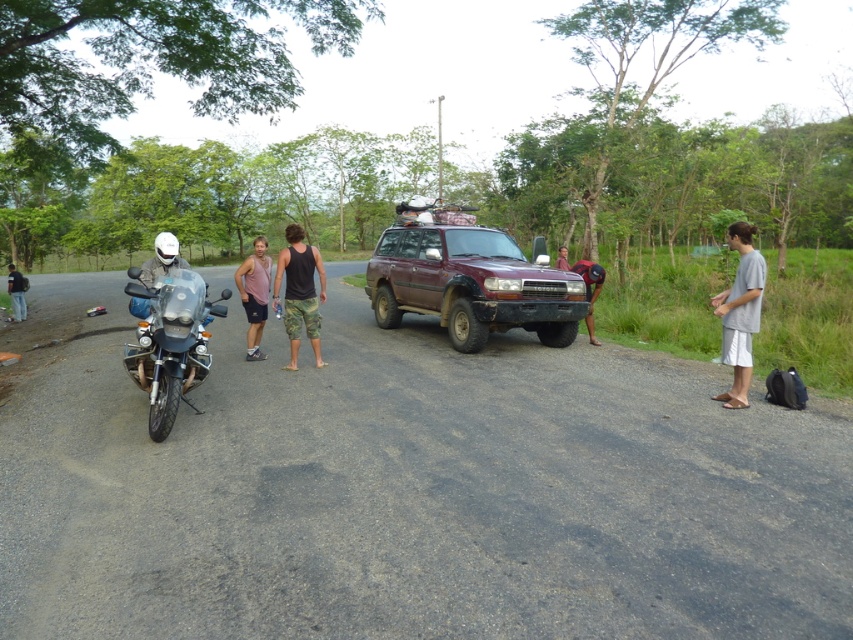
You are a photographer standing at the center of the scene. You want to take a photo that includes both the pink tank top at center and the brushed metal helmet at left. Which object should you adjust your position to ensure both are fully visible in the frame?

The pink tank top at center is in front of the brushed metal helmet at left. To ensure both are fully visible, you should move your position slightly to the side so that the pink tank top at center doesn not block the view of the brushed metal helmet at left.

You are standing at the point labeled point (25,307) and want to walk to the point labeled point (258,348). Which direction should you face to walk towards your destination?

Since point (258,348) is closer to the viewer than point (25,307), you should face towards the direction away from the viewer to reach your destination.

You are a photographer setting up a tripod to capture the scene. The shiny metallic motorcycle at left and the gray cotton shirt at right are both in your view. Based on their heights, which object should you adjust your camera angle upwards to focus on?

The gray cotton shirt at right is taller than the shiny metallic motorcycle at left, so you should adjust your camera angle upwards to focus on the gray cotton shirt at right.